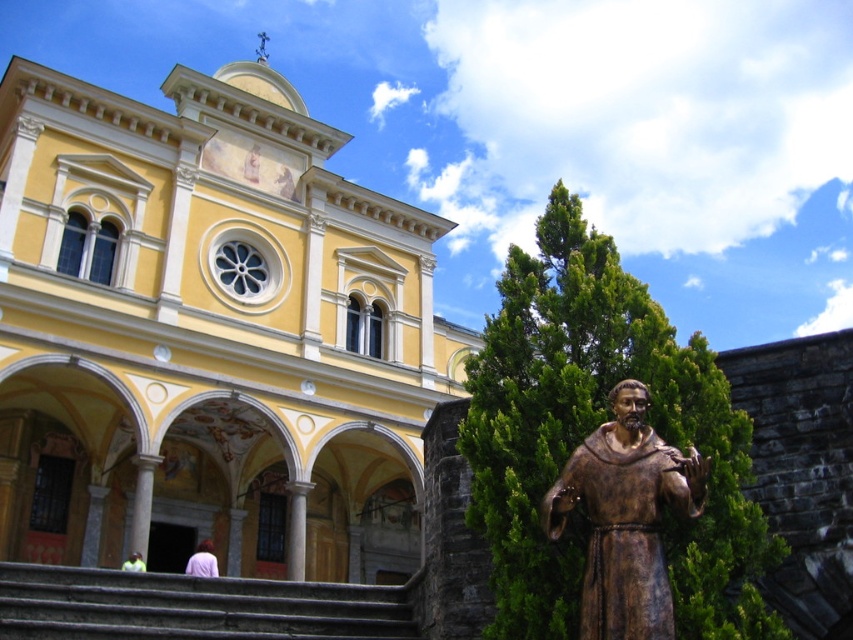
You are an architect analyzing the spatial arrangement of the building. Based on the image, where is the yellow painted stone church at upper left positioned relative to the light purple fabric at lower center?

The yellow painted stone church at upper left is positioned above the light purple fabric at lower center.